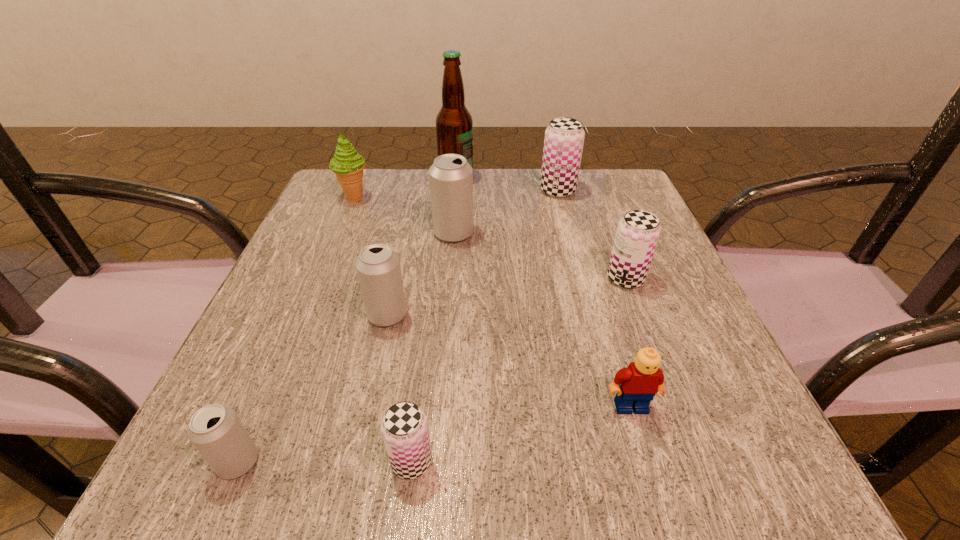
At what (x,y) coordinates should I click in order to perform the action: click on the second biggest white beer can. Please return your answer as a coordinate pair (x, y). Looking at the image, I should click on (378, 269).

Where is `yellow Lego`? yellow Lego is located at coordinates (636, 385).

This screenshot has height=540, width=960. Identify the location of the third nearest object. (636, 385).

At what (x,y) coordinates should I click in order to perform the action: click on the nearest purple beer can. Please return your answer as a coordinate pair (x, y). Looking at the image, I should click on (404, 427).

Locate an element on the screen. This screenshot has height=540, width=960. the leftmost purple beer can is located at coordinates (404, 427).

Where is `the smallest white beer can`? the smallest white beer can is located at coordinates (215, 430).

Locate an element on the screen. the leftmost white beer can is located at coordinates (215, 430).

Locate an element on the screen. vacant space located 0.280m on the label of the beer bottle is located at coordinates (585, 178).

I want to click on blank area located on the front of the farthest beer can, so click(x=582, y=282).

The width and height of the screenshot is (960, 540). In order to click on vacant position located on the left of the rightmost white beer can in this screenshot , I will do `click(391, 233)`.